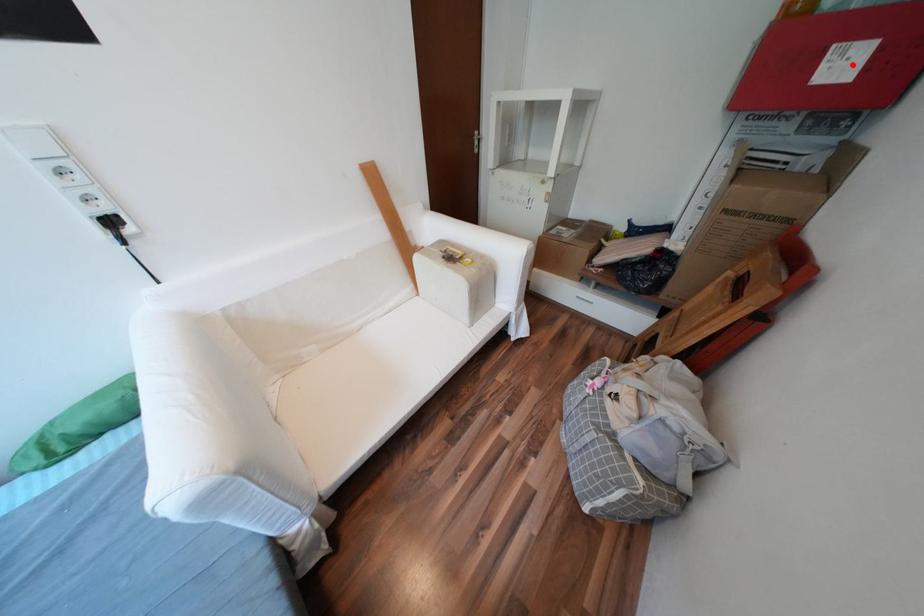
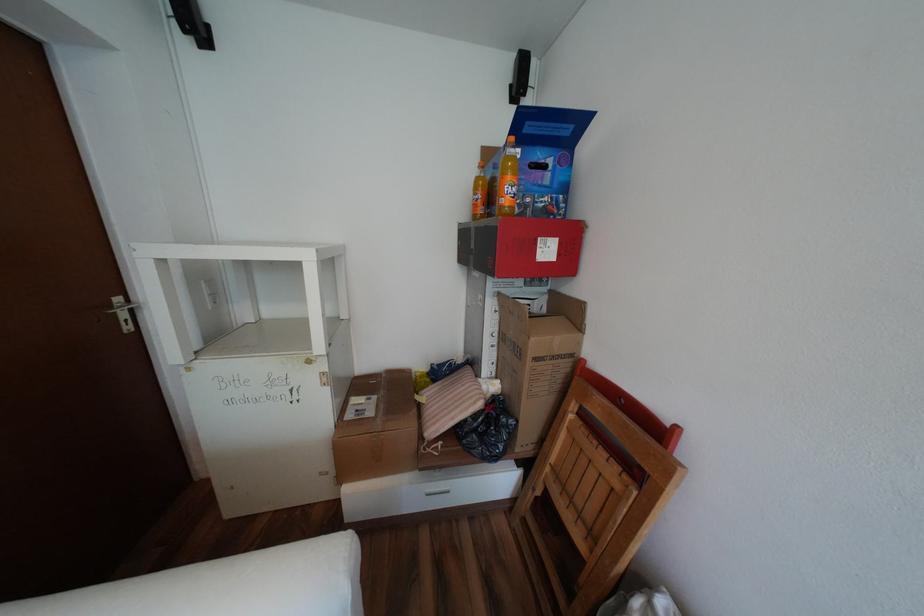
Where in the second image is the point corresponding to the highlighted location from the first image?

(556, 251)